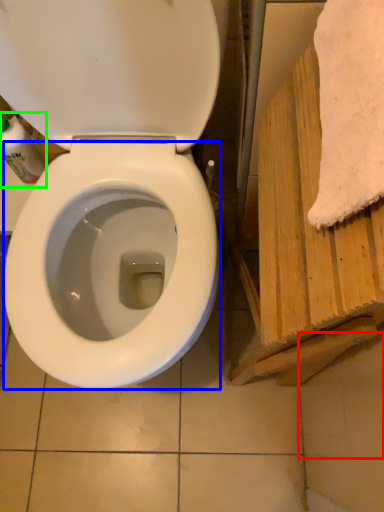
Question: Considering the real-world distances, which object is closest to tile (highlighted by a red box)? bidet (highlighted by a blue box) or cleaning product (highlighted by a green box).

Choices:
 (A) bidet
 (B) cleaning product

Answer: (A)